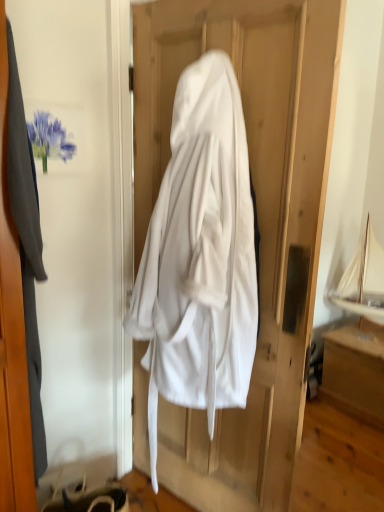
Question: From a real-world perspective, is white fabric hanger at lower left located beneath white cloth at center?

Choices:
 (A) no
 (B) yes

Answer: (B)

Question: Can you see white fabric hanger at lower left touching white cloth at center?

Choices:
 (A) yes
 (B) no

Answer: (B)

Question: Considering the relative sizes of white fabric hanger at lower left and white cloth at center in the image provided, is white fabric hanger at lower left thinner than white cloth at center?

Choices:
 (A) yes
 (B) no

Answer: (A)

Question: Does white fabric hanger at lower left contain white cloth at center?

Choices:
 (A) no
 (B) yes

Answer: (A)

Question: From a real-world perspective, is white fabric hanger at lower left on white cloth at center?

Choices:
 (A) yes
 (B) no

Answer: (B)

Question: From the image's perspective, is white cloth at center above or below wooden drawer at lower right?

Choices:
 (A) below
 (B) above

Answer: (B)

Question: Is point (170, 55) positioned closer to the camera than point (342, 386)?

Choices:
 (A) farther
 (B) closer

Answer: (B)

Question: In terms of width, does white cloth at center look wider or thinner when compared to wooden drawer at lower right?

Choices:
 (A) thin
 (B) wide

Answer: (A)

Question: From their relative heights in the image, would you say white cloth at center is taller or shorter than wooden drawer at lower right?

Choices:
 (A) tall
 (B) short

Answer: (A)

Question: Is point (304, 294) closer or farther from the camera than point (87, 321)?

Choices:
 (A) closer
 (B) farther

Answer: (A)

Question: From a real-world perspective, is white cloth at center above or below gray fabric screen door at left?

Choices:
 (A) above
 (B) below

Answer: (B)

Question: Relative to gray fabric screen door at left, is white cloth at center in front or behind?

Choices:
 (A) front
 (B) behind

Answer: (B)

Question: Would you say white cloth at center is inside or outside gray fabric screen door at left?

Choices:
 (A) inside
 (B) outside

Answer: (B)

Question: Looking at their shapes, would you say matte gray coat at left is wider or thinner than gray fabric screen door at left?

Choices:
 (A) wide
 (B) thin

Answer: (A)

Question: Does point (29, 165) appear closer or farther from the camera than point (104, 17)?

Choices:
 (A) farther
 (B) closer

Answer: (B)